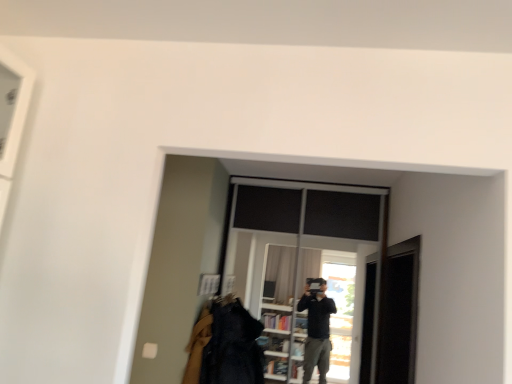
Question: Is denim jacket at lower center directly adjacent to transparent glass screen door at right?

Choices:
 (A) no
 (B) yes

Answer: (A)

Question: Is denim jacket at lower center shorter than transparent glass screen door at right?

Choices:
 (A) no
 (B) yes

Answer: (B)

Question: Is transparent glass screen door at right surrounded by denim jacket at lower center?

Choices:
 (A) no
 (B) yes

Answer: (A)

Question: From the image's perspective, is denim jacket at lower center over transparent glass screen door at right?

Choices:
 (A) no
 (B) yes

Answer: (A)

Question: Does denim jacket at lower center have a greater height compared to transparent glass screen door at right?

Choices:
 (A) no
 (B) yes

Answer: (A)

Question: From their relative heights in the image, would you say transparent glass window at center is taller or shorter than transparent glass screen door at right?

Choices:
 (A) tall
 (B) short

Answer: (A)

Question: In terms of size, does transparent glass window at center appear bigger or smaller than transparent glass screen door at right?

Choices:
 (A) small
 (B) big

Answer: (B)

Question: Is transparent glass window at center situated inside transparent glass screen door at right or outside?

Choices:
 (A) inside
 (B) outside

Answer: (B)

Question: From the image's perspective, is transparent glass window at center above or below transparent glass screen door at right?

Choices:
 (A) below
 (B) above

Answer: (B)

Question: Considering their positions, is denim jacket at lower center located in front of or behind transparent glass window at center?

Choices:
 (A) behind
 (B) front

Answer: (B)

Question: In terms of width, does denim jacket at lower center look wider or thinner when compared to transparent glass window at center?

Choices:
 (A) wide
 (B) thin

Answer: (A)

Question: Is denim jacket at lower center bigger or smaller than transparent glass window at center?

Choices:
 (A) small
 (B) big

Answer: (A)

Question: From a real-world perspective, is denim jacket at lower center above or below transparent glass window at center?

Choices:
 (A) below
 (B) above

Answer: (A)

Question: Does point (387, 284) appear closer or farther from the camera than point (231, 307)?

Choices:
 (A) closer
 (B) farther

Answer: (A)

Question: In the image, is transparent glass screen door at right on the left side or the right side of denim jacket at lower center?

Choices:
 (A) left
 (B) right

Answer: (B)